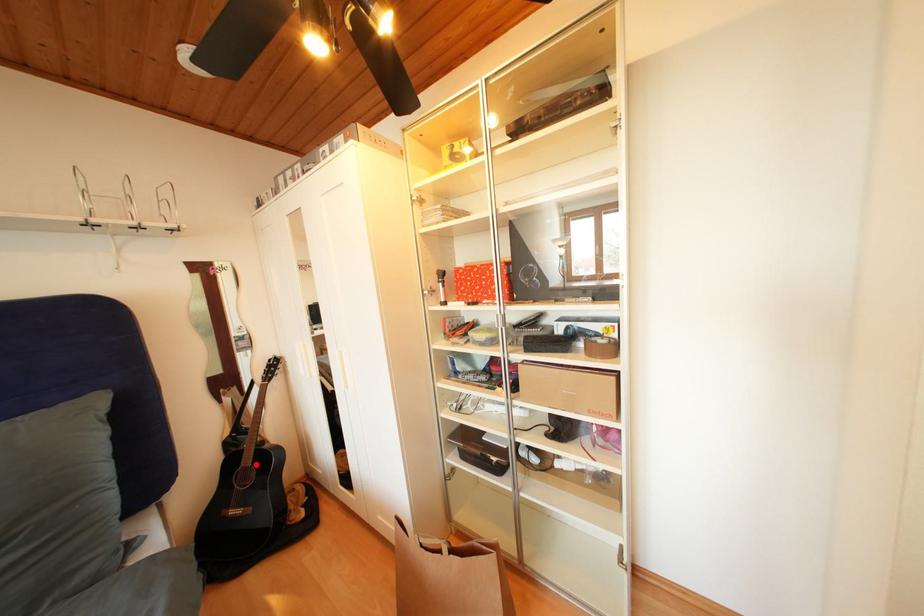
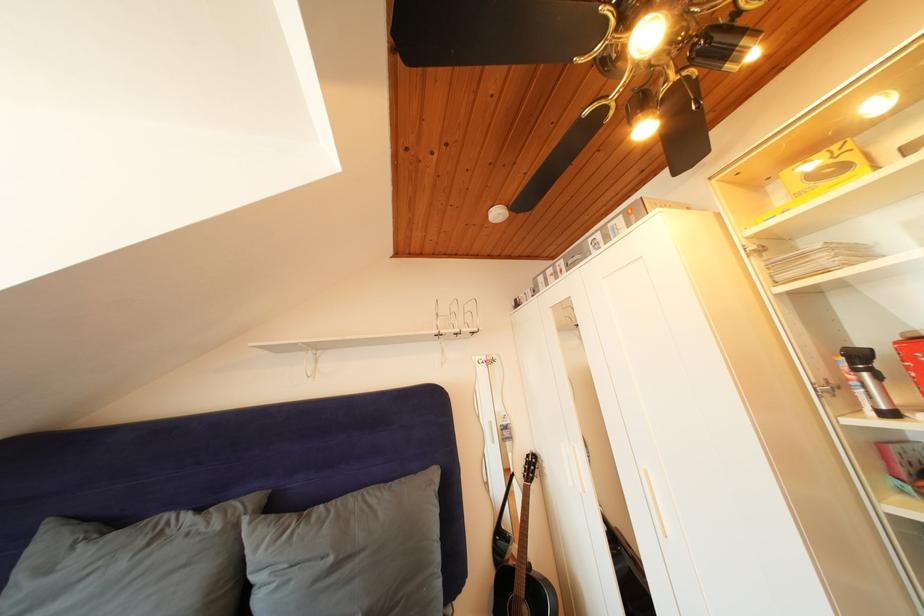
Locate, in the second image, the point that corresponds to the highlighted location in the first image.

(528, 592)